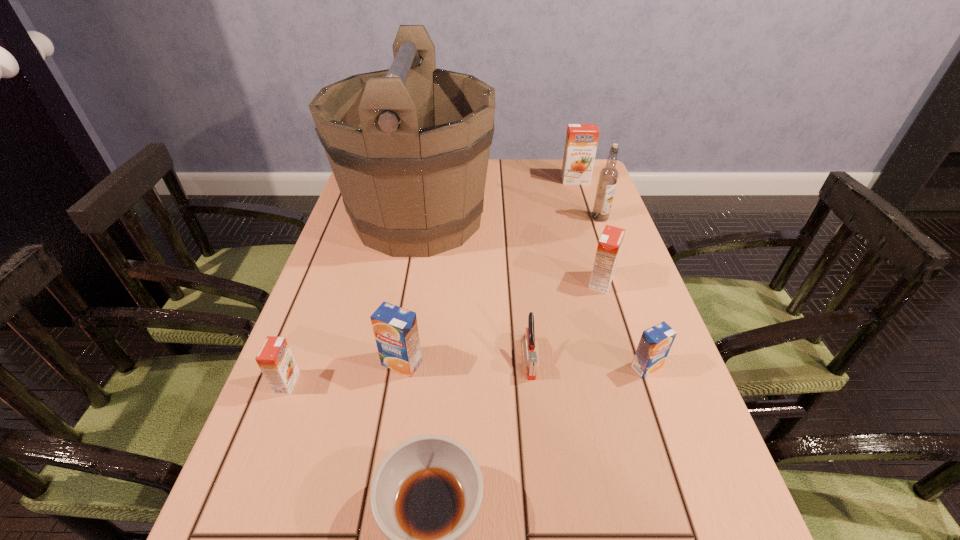
This screenshot has height=540, width=960. Identify the location of the tallest object. (409, 146).

Locate an element on the screen. This screenshot has width=960, height=540. vodka is located at coordinates (608, 176).

Where is `the farthest orange orange juice`? The image size is (960, 540). the farthest orange orange juice is located at coordinates (581, 142).

Locate an element on the screen. Image resolution: width=960 pixels, height=540 pixels. the biggest orange orange juice is located at coordinates (581, 142).

You are a GUI agent. You are given a task and a screenshot of the screen. Output one action in this format:
    pyautogui.click(x=<x>, y=<y>)
    Task: Click on the second farthest orange orange juice
    This screenshot has height=540, width=960.
    Given the screenshot: What is the action you would take?
    pyautogui.click(x=609, y=245)

Locate an element on the screen. the second farthest orange juice is located at coordinates (609, 245).

Find the location of a particular element. This screenshot has height=540, width=960. the fourth orange juice from right to left is located at coordinates (395, 329).

I want to click on the bigger blue orange_juice, so click(x=395, y=329).

You are a GUI agent. You are given a task and a screenshot of the screen. Output one action in this format:
    pyautogui.click(x=<x>, y=<y>)
    Task: Click on the right blue orange_juice
    
    Given the screenshot: What is the action you would take?
    pyautogui.click(x=655, y=343)

Find the location of a particular element. This screenshot has width=960, height=540. the smallest orange orange juice is located at coordinates (275, 359).